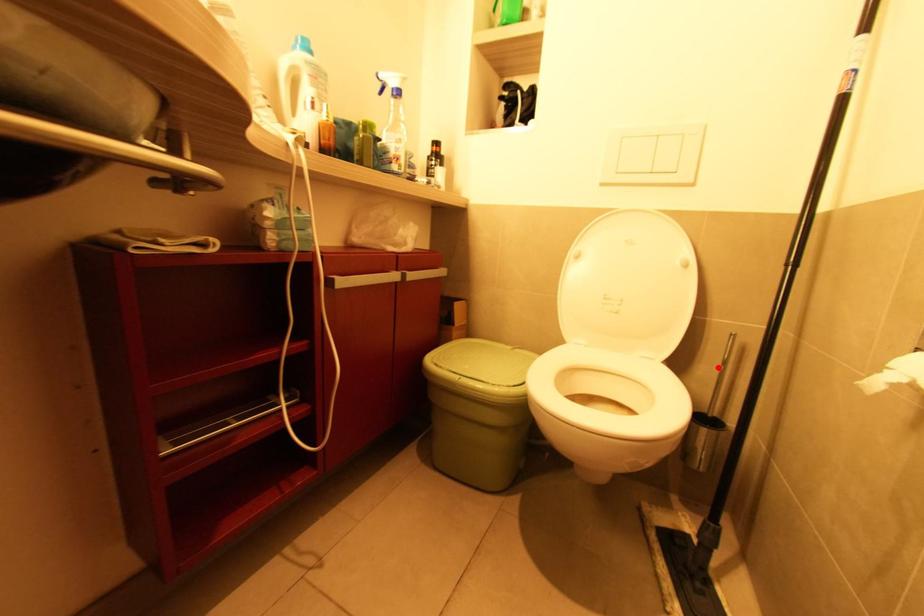
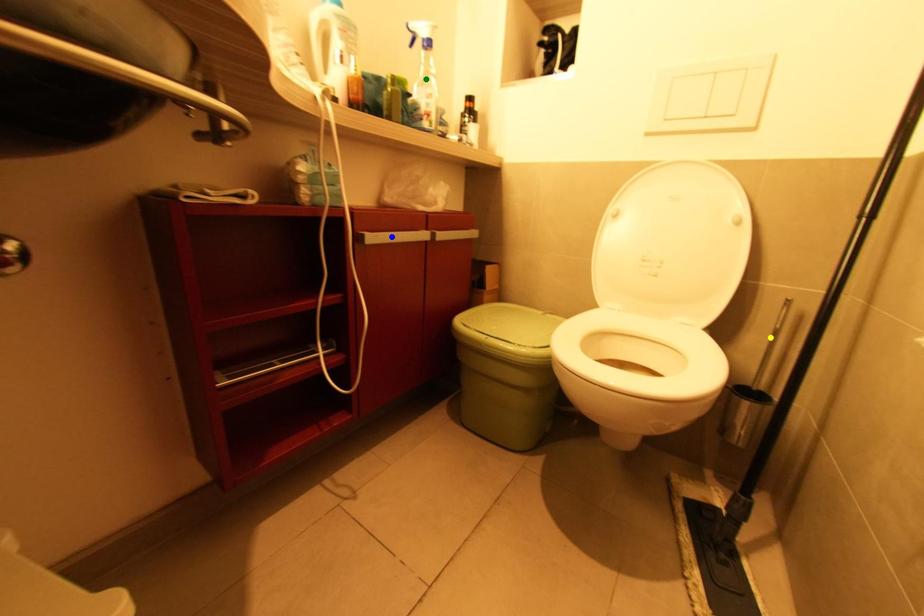
Question: I am providing you with two images of the same scene from different viewpoints. A red point is marked on the first image. You are given multiple points on the second image. Can you choose the point in image 2 that corresponds to the point in image 1?

Choices:
 (A) green point
 (B) yellow point
 (C) blue point

Answer: (B)